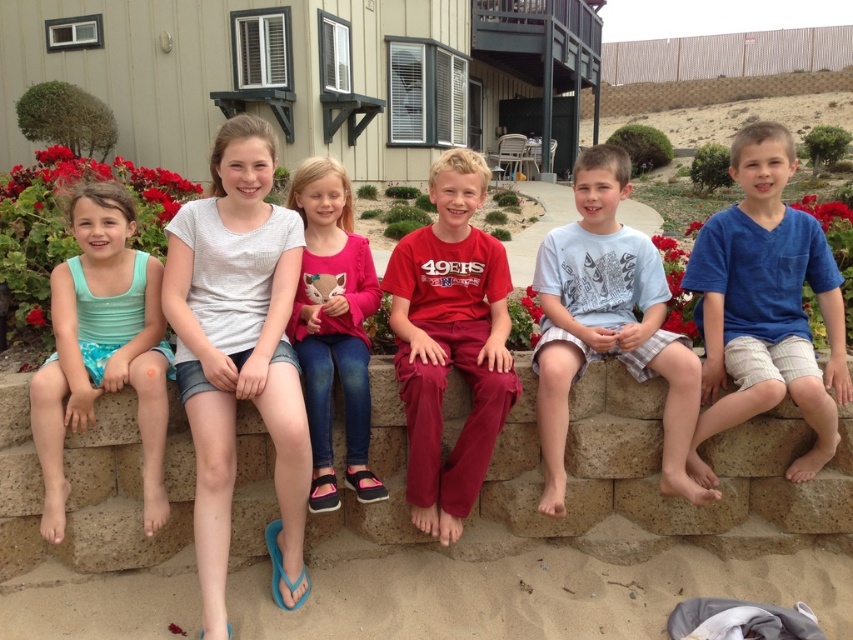
Question: Is blue cotton shirt at center to the right of matte teal swimsuit at left from the viewer's perspective?

Choices:
 (A) no
 (B) yes

Answer: (B)

Question: Which point is farther to the camera?

Choices:
 (A) blue cotton shirt at center
 (B) light blue cotton shirt at center

Answer: (A)

Question: Does red matte pants at center have a lesser width compared to light blue cotton shirt at center?

Choices:
 (A) yes
 (B) no

Answer: (A)

Question: Which object is closer to the camera taking this photo?

Choices:
 (A) blue cotton shirt at center
 (B) red matte pants at center

Answer: (B)

Question: Can you confirm if matte teal swimsuit at left is bigger than pink fleece sweater at center?

Choices:
 (A) no
 (B) yes

Answer: (A)

Question: Considering the real-world distances, which object is closest to the light blue cotton shirt at center?

Choices:
 (A) blue cotton shirt at center
 (B) red matte pants at center
 (C) matte teal swimsuit at left

Answer: (A)